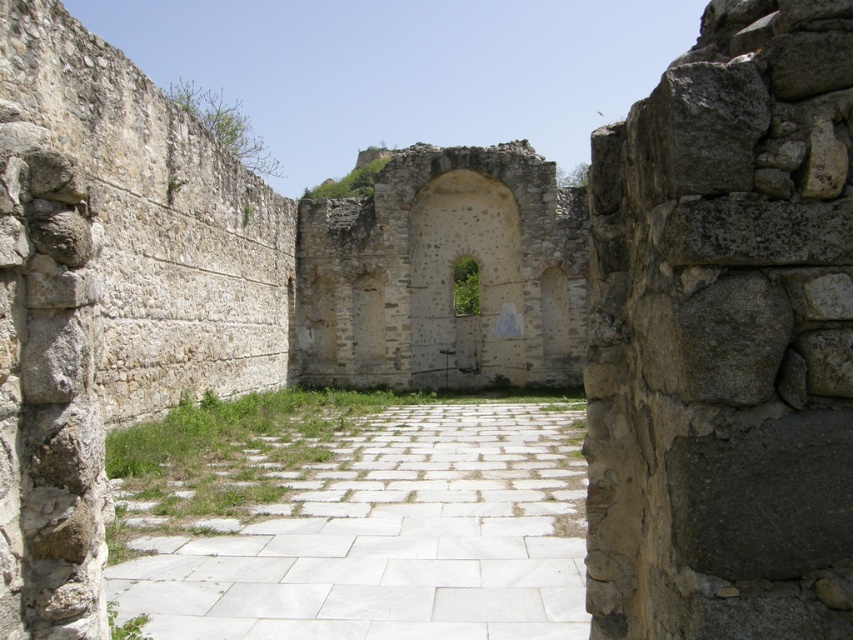
Does point (474, 326) come farther from viewer compared to point (485, 246)?

Yes.

Does stone archway at center have a lesser height compared to stone textured archway at center?

No, stone archway at center is not shorter than stone textured archway at center.

Does point (358, 320) come behind point (445, 323)?

No, it is not.

Where is `stone archway at center`? The image size is (853, 640). stone archway at center is located at coordinates (444, 273).

Does white stone path at center have a greater height compared to stone archway at center?

No.

Can you confirm if white stone path at center is positioned above stone archway at center?

Actually, white stone path at center is below stone archway at center.

What do you see at coordinates (390, 538) in the screenshot? The image size is (853, 640). I see `white stone path at center` at bounding box center [390, 538].

This screenshot has height=640, width=853. I want to click on white stone path at center, so click(x=390, y=538).

Which is above, white stone path at center or stone textured archway at center?

stone textured archway at center

Does white stone path at center have a larger size compared to stone textured archway at center?

No, white stone path at center is not bigger than stone textured archway at center.

In order to click on white stone path at center in this screenshot , I will do `click(390, 538)`.